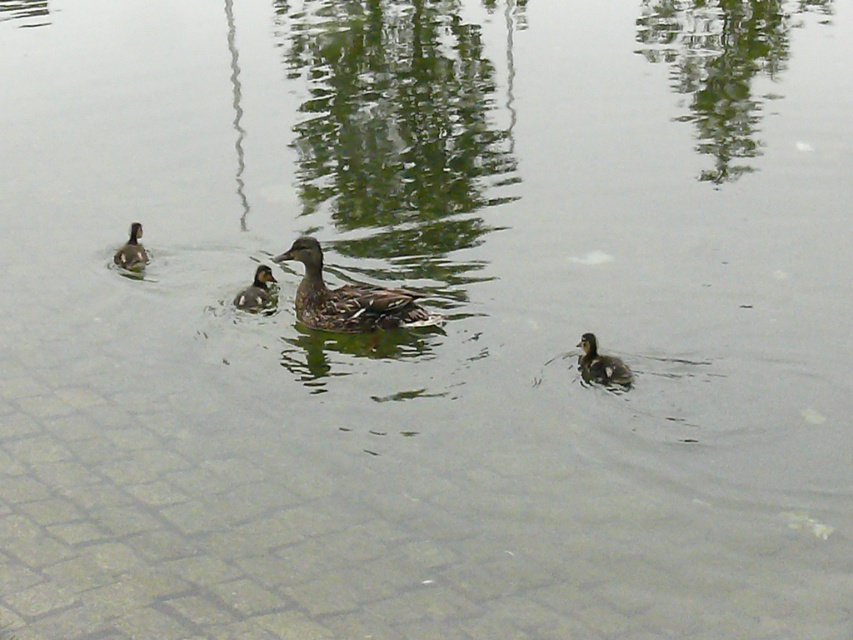
You are a photographer trying to capture a clear shot of both the brown speckled duckling at center and the brown matte duckling at left. Which duckling is blocking the view of the other?

The brown speckled duckling at center is positioned under the brown matte duckling at left, so the brown matte duckling at left is blocking the view of the brown speckled duckling at center.

You are a photographer trying to capture a photo of the brown matte duckling at center and the brown matte duckling at left. From your current position, which duckling is positioned more to your left?

The brown matte duckling at left is positioned more to the left than the brown matte duckling at center.

You are a small boat operator who needs to navigate between the brown speckled duckling at center and the brown matte duckling at left. The boat requires a minimum of 1.5 meters of space to safely pass. Can you safely navigate between them?

The distance between the brown speckled duckling at center and the brown matte duckling at left is 1.71 meters, which is greater than the required 1.5 meters. Therefore, the boat can safely navigate between them.